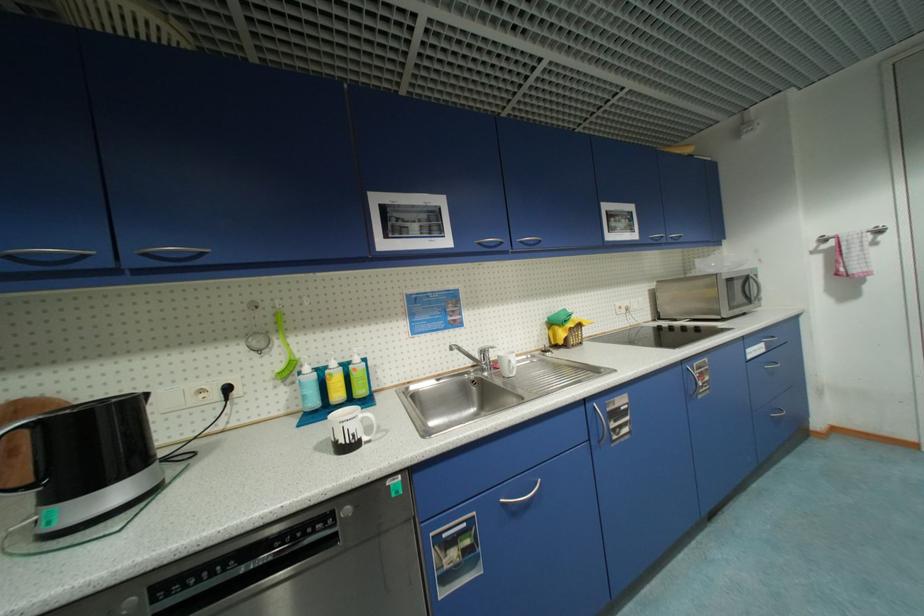
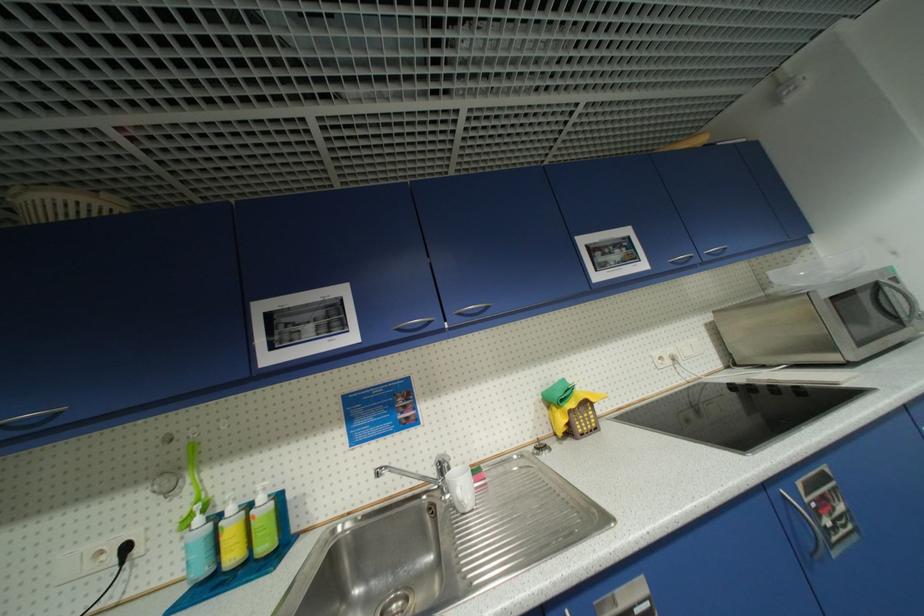
Where in the second image is the point corresponding to [362,360] from the first image?

(266, 500)